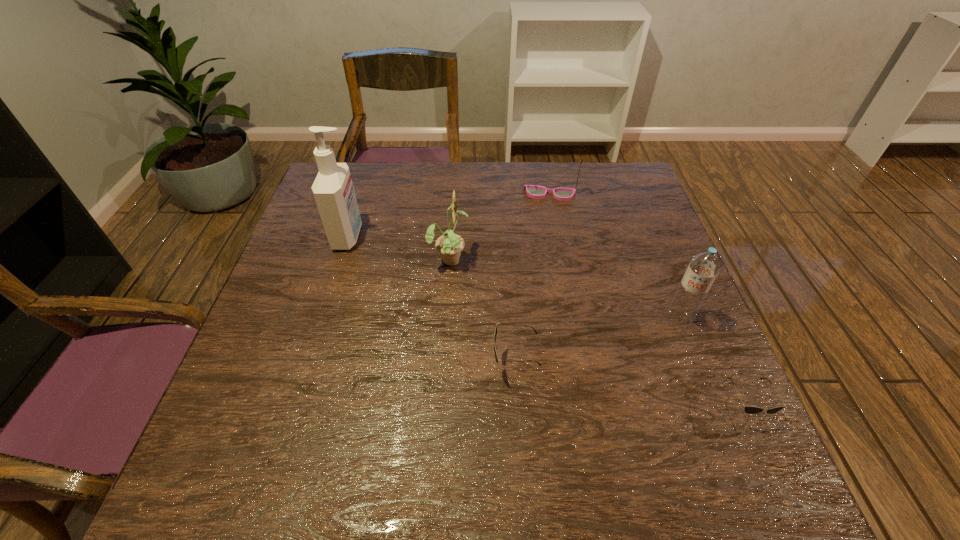
Find the location of `free space in the image that satisfies the following two spatial constraints: 1. on the front side of the spectacles; 2. on the front label of the cleansing agent`. free space in the image that satisfies the following two spatial constraints: 1. on the front side of the spectacles; 2. on the front label of the cleansing agent is located at coordinates (557, 237).